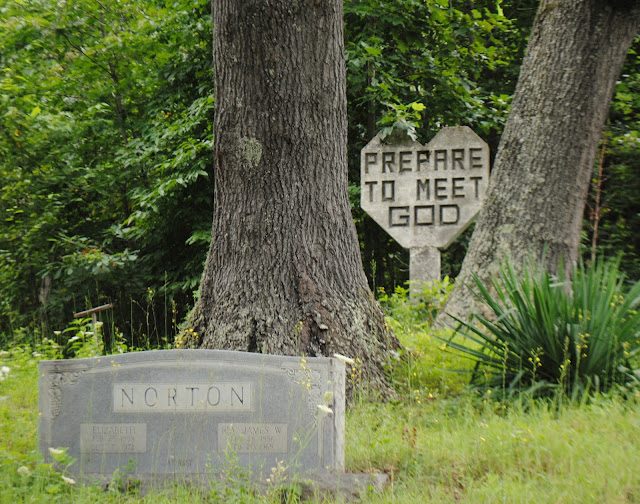
Locate an element on the screen. This screenshot has height=504, width=640. green plant is located at coordinates (541, 319).